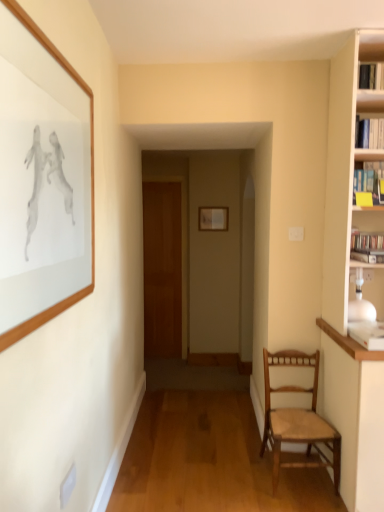
Question: From the image's perspective, is wooden woven seat chair at right located beneath wooden door at center?

Choices:
 (A) yes
 (B) no

Answer: (A)

Question: From a real-world perspective, is wooden woven seat chair at right below wooden door at center?

Choices:
 (A) no
 (B) yes

Answer: (B)

Question: Is wooden woven seat chair at right located outside wooden door at center?

Choices:
 (A) yes
 (B) no

Answer: (A)

Question: Does wooden woven seat chair at right turn towards wooden door at center?

Choices:
 (A) no
 (B) yes

Answer: (A)

Question: Is the depth of wooden woven seat chair at right less than that of wooden door at center?

Choices:
 (A) yes
 (B) no

Answer: (A)

Question: Considering the positions of matte silver picture frame at center, which is counted as the first picture frame, starting from the right, and wooden door at center in the image, is matte silver picture frame at center, which is counted as the first picture frame, starting from the right, taller or shorter than wooden door at center?

Choices:
 (A) short
 (B) tall

Answer: (A)

Question: From a real-world perspective, is matte silver picture frame at center, which is counted as the first picture frame, starting from the right, above or below wooden door at center?

Choices:
 (A) above
 (B) below

Answer: (A)

Question: Looking at the image, does matte silver picture frame at center, which is counted as the first picture frame, starting from the right, seem bigger or smaller compared to wooden door at center?

Choices:
 (A) small
 (B) big

Answer: (A)

Question: Choose the correct answer: Is matte silver picture frame at center, which is the second picture frame in front-to-back order, inside wooden door at center or outside it?

Choices:
 (A) outside
 (B) inside

Answer: (A)

Question: From their relative heights in the image, would you say wooden woven seat chair at right is taller or shorter than matte silver picture frame at center, the 1th picture frame viewed from the back?

Choices:
 (A) tall
 (B) short

Answer: (A)

Question: Is wooden woven seat chair at right bigger or smaller than matte silver picture frame at center, which is counted as the first picture frame, starting from the right?

Choices:
 (A) big
 (B) small

Answer: (A)

Question: From a real-world perspective, is wooden woven seat chair at right positioned above or below matte silver picture frame at center, which is the second picture frame in front-to-back order?

Choices:
 (A) above
 (B) below

Answer: (B)

Question: Is wooden woven seat chair at right situated inside matte silver picture frame at center, which is counted as the first picture frame, starting from the right, or outside?

Choices:
 (A) inside
 (B) outside

Answer: (B)

Question: Is wooden door at center inside the boundaries of wooden woven seat chair at right, or outside?

Choices:
 (A) outside
 (B) inside

Answer: (A)

Question: From a real-world perspective, relative to wooden woven seat chair at right, is wooden door at center vertically above or below?

Choices:
 (A) above
 (B) below

Answer: (A)